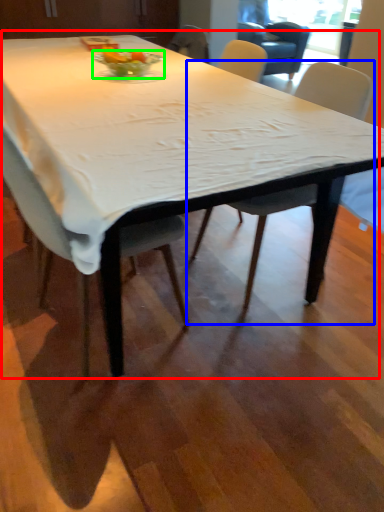
Question: Estimate the real-world distances between objects in this image. Which object is closer to table (highlighted by a red box), chair (highlighted by a blue box) or glass bowl (highlighted by a green box)?

Choices:
 (A) chair
 (B) glass bowl

Answer: (B)